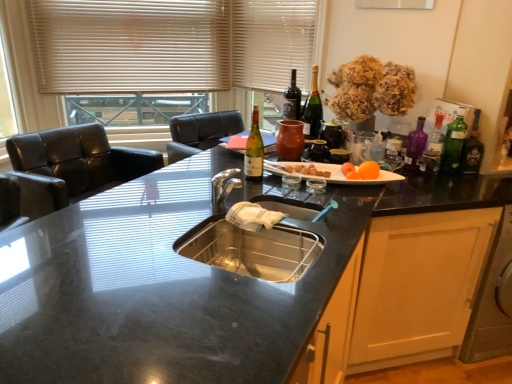
Question: Is orange matte at upper right wider or thinner than black granite countertop at center?

Choices:
 (A) wide
 (B) thin

Answer: (B)

Question: From the image's perspective, relative to black granite countertop at center, is orange matte at upper right above or below?

Choices:
 (A) below
 (B) above

Answer: (B)

Question: Which is nearer to the orange matte at upper right?

Choices:
 (A) beige blinds at upper left
 (B) orange matte at upper center
 (C) black granite countertop at center
 (D) white fabric curtain at upper center
 (E) matte glass wine bottle at center, which appears as the fifth bottle when viewed from the right

Answer: (B)

Question: Estimate the real-world distances between objects in this image. Which object is closer to the black granite countertop at center?

Choices:
 (A) white fabric curtain at upper center
 (B) matte glass wine bottle at center, positioned as the 1th bottle in back-to-front order
 (C) green glass bottle at right, placed as the second bottle when sorted from front to back
 (D) orange matte at upper center
 (E) matte glass wine bottle at center, acting as the 1th bottle starting from the front

Answer: (E)